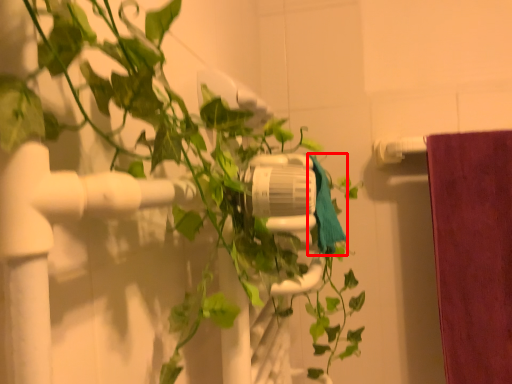
Question: From the image's perspective, what is the correct spatial positioning of bath towel (annotated by the red box) in reference to houseplant?

Choices:
 (A) below
 (B) above

Answer: (B)